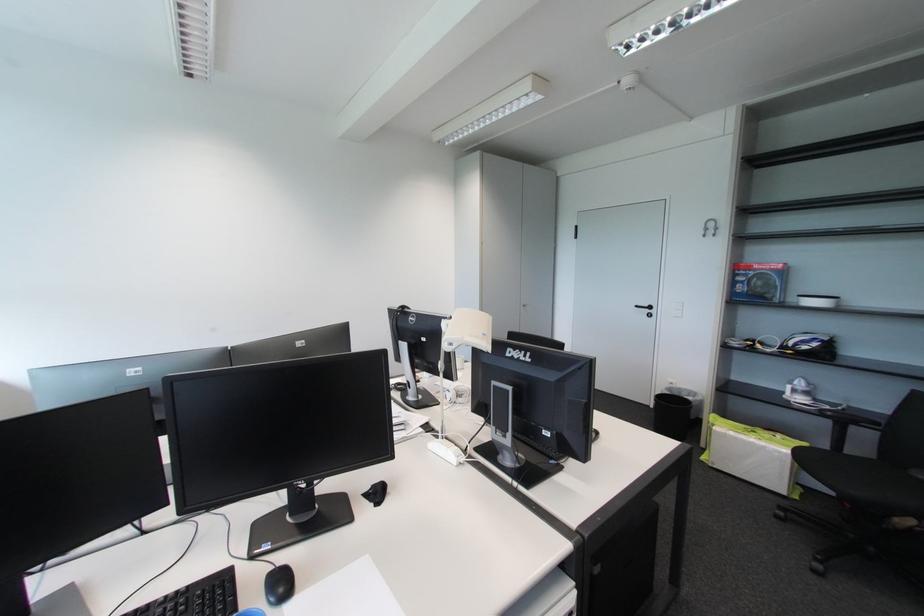
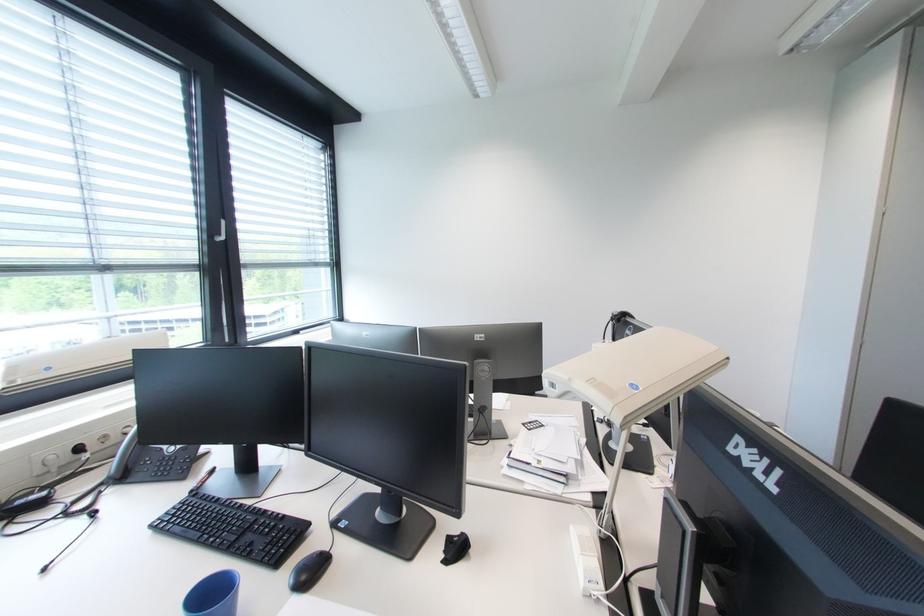
Question: The camera is either moving clockwise (left) or counter-clockwise (right) around the object. The first image is from the beginning of the video and the second image is from the end. Is the camera moving left or right when shooting the video?

Choices:
 (A) Left
 (B) Right

Answer: (B)